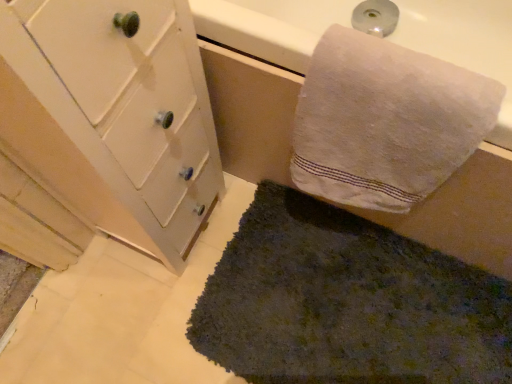
Question: In terms of width, does white painted wood cabinet at left look wider or thinner when compared to white cotton towel at upper right?

Choices:
 (A) thin
 (B) wide

Answer: (B)

Question: Relative to white cotton towel at upper right, is white painted wood cabinet at left in front or behind?

Choices:
 (A) behind
 (B) front

Answer: (B)

Question: Which object is positioned farthest from the white painted wood cabinet at left?

Choices:
 (A) dark green shaggy rug at lower center
 (B) white cotton towel at upper right

Answer: (A)

Question: Which of these objects is positioned farthest from the dark green shaggy rug at lower center?

Choices:
 (A) white cotton towel at upper right
 (B) white painted wood cabinet at left

Answer: (B)